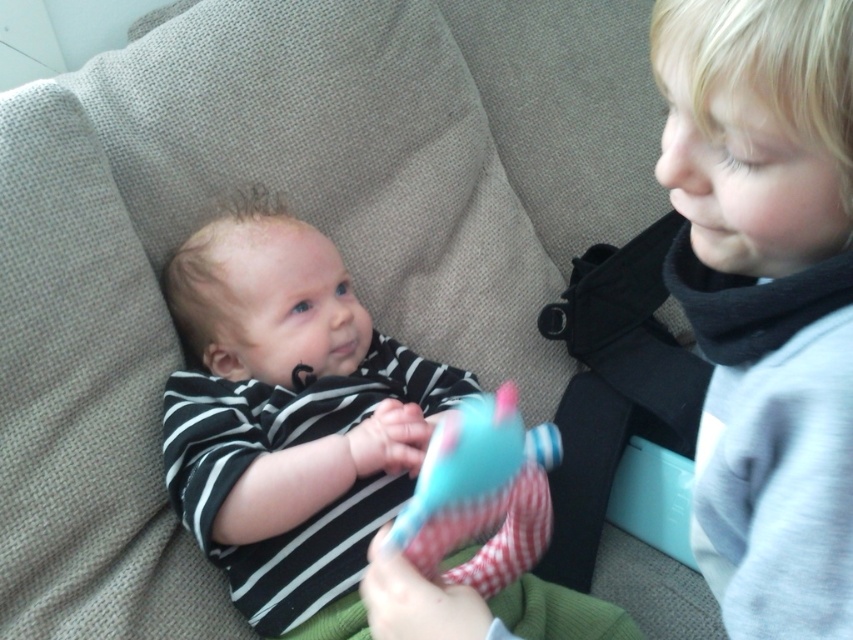
You are a tailor trying to decide whether to place a new embroidered patch on the smooth gray sweater at right or the plush cotton toy at center. Since the patch is 10 cm wide, which item can accommodate it without the patch being too small?

The smooth gray sweater at right has a larger width than the plush cotton toy at center, so the embroidered patch can be placed on the smooth gray sweater at right as it has enough space to accommodate the 10 cm wide patch without it being too small.

You are a photographer trying to capture a closeup of the smooth gray sweater at right and the plush cotton toy at center. Which object should you focus on first to ensure it appears sharp in the photo?

The smooth gray sweater at right should be focused on first because it is closer to the viewer than the plush cotton toy at center, so focusing on it will ensure it appears sharp while the toy may be slightly out of focus due to the distance difference.